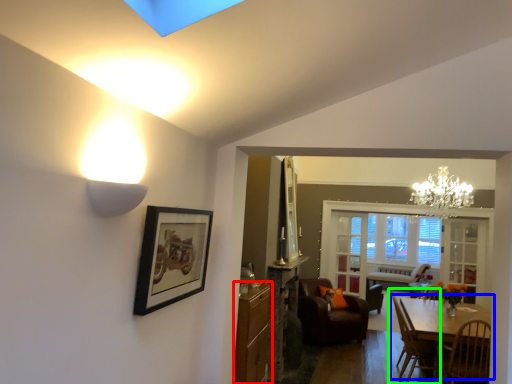
Question: Considering the real-world distances, which object is farthest from cabinetry (highlighted by a red box)? table (highlighted by a blue box) or chair (highlighted by a green box)?

Choices:
 (A) table
 (B) chair

Answer: (B)